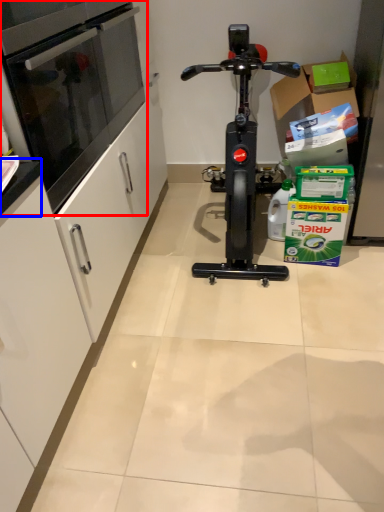
Question: Which of the following is the farthest to the observer, oven (highlighted by a red box) or counter top (highlighted by a blue box)?

Choices:
 (A) oven
 (B) counter top

Answer: (A)